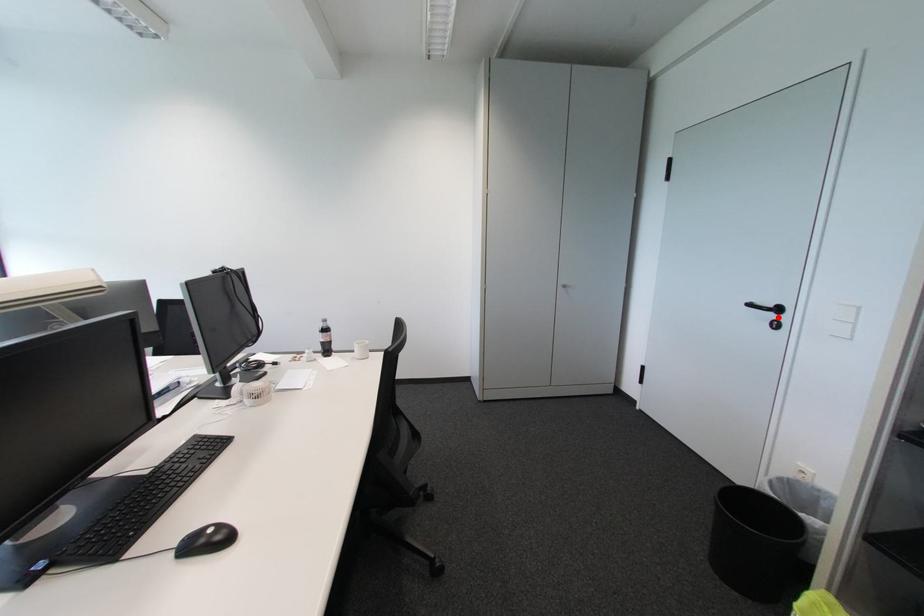
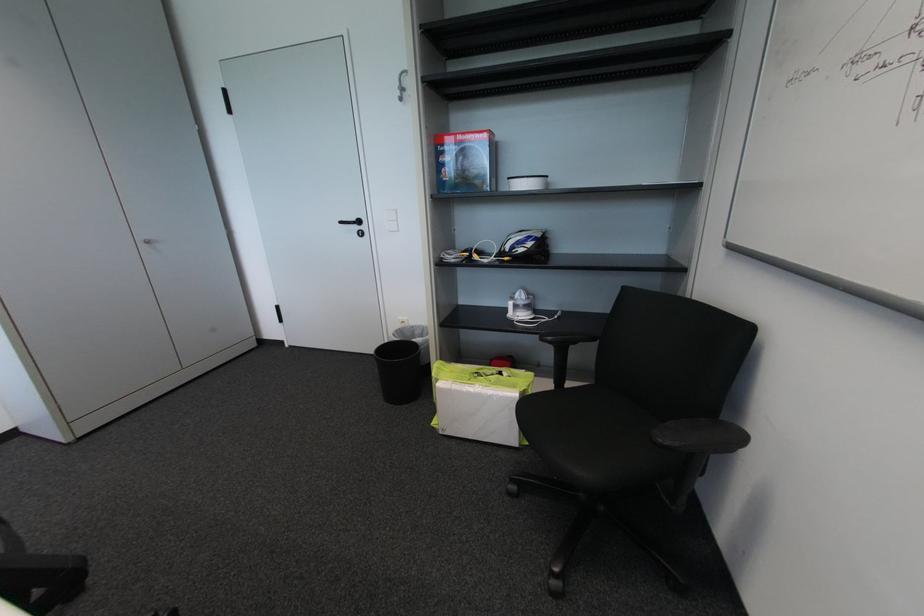
Question: I am providing you with two images of the same scene from different viewpoints. A red point is marked on the first image. Can you still see the location of the red point in image 2?

Choices:
 (A) Yes
 (B) No

Answer: (A)